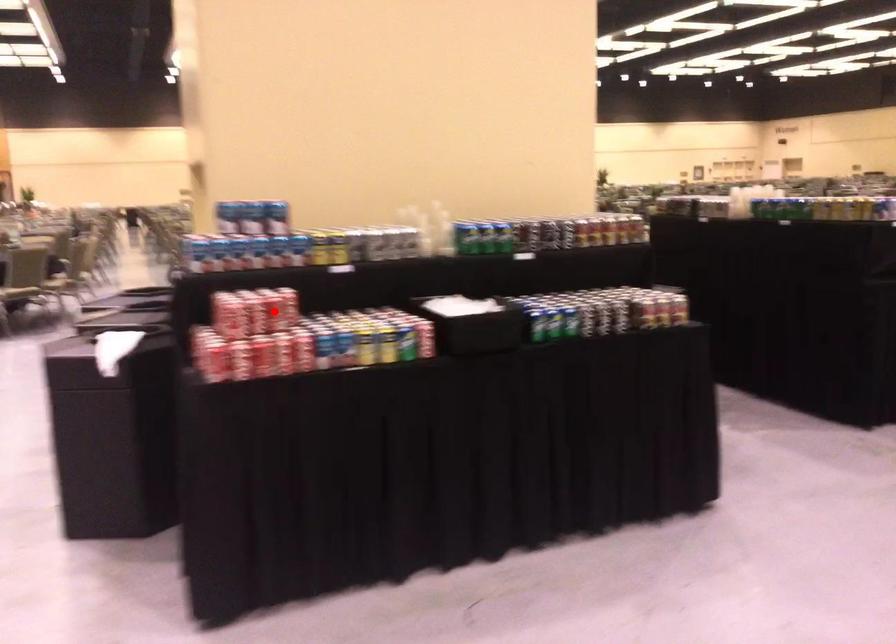
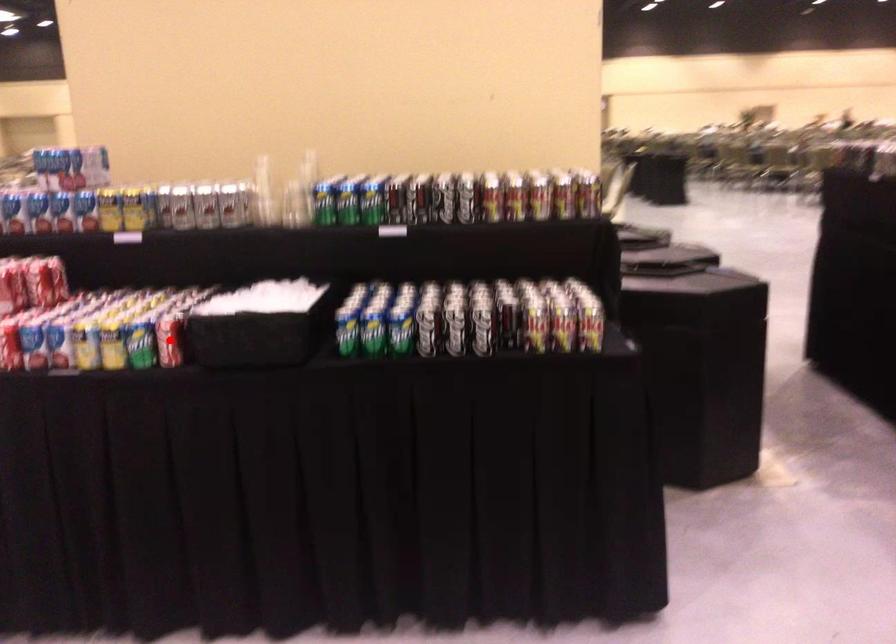
I am providing you with two images of the same scene from different viewpoints. A red point is marked on the first image and another point is marked on the second image. Is the marked point in image1 the same physical position as the marked point in image2?

No